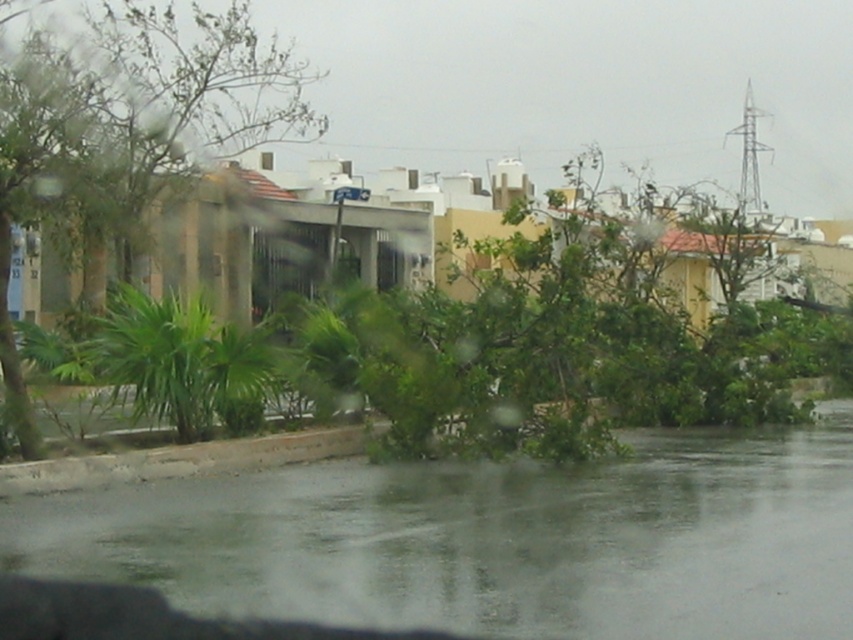
Question: Among these points, which one is nearest to the camera?

Choices:
 (A) (94, 541)
 (B) (136, 184)

Answer: (A)

Question: Is clear water at lower center below green leafy tree at left?

Choices:
 (A) yes
 (B) no

Answer: (A)

Question: Which point is farther to the camera?

Choices:
 (A) (746, 604)
 (B) (200, 134)

Answer: (B)

Question: Does clear water at lower center have a larger size compared to green leafy tree at left?

Choices:
 (A) yes
 (B) no

Answer: (B)

Question: Which of the following is the farthest from the observer?

Choices:
 (A) clear water at lower center
 (B) green leafy tree at left

Answer: (B)

Question: Does clear water at lower center appear on the left side of green leafy tree at left?

Choices:
 (A) yes
 (B) no

Answer: (B)